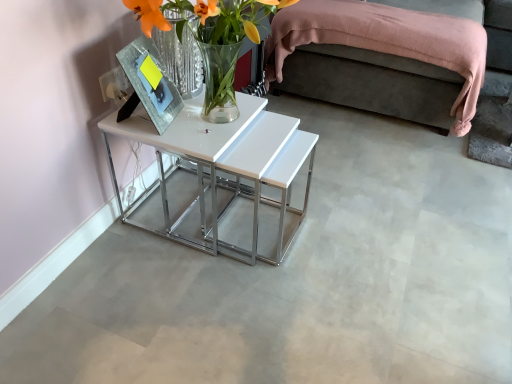
Question: Is translucent glass vase at center wider than white glossy table at center?

Choices:
 (A) yes
 (B) no

Answer: (B)

Question: Is translucent glass vase at center thinner than white glossy table at center?

Choices:
 (A) no
 (B) yes

Answer: (B)

Question: Is translucent glass vase at center touching white glossy table at center?

Choices:
 (A) yes
 (B) no

Answer: (B)

Question: From the image's perspective, is translucent glass vase at center located above white glossy table at center?

Choices:
 (A) no
 (B) yes

Answer: (B)

Question: Is translucent glass vase at center shorter than white glossy table at center?

Choices:
 (A) no
 (B) yes

Answer: (B)

Question: From a real-world perspective, is translucent glass vase at center below white glossy table at center?

Choices:
 (A) no
 (B) yes

Answer: (A)

Question: From the image's perspective, is white glossy table at center located beneath translucent glass vase at center?

Choices:
 (A) no
 (B) yes

Answer: (B)

Question: Is white glossy table at center beside translucent glass vase at center?

Choices:
 (A) yes
 (B) no

Answer: (B)

Question: Is translucent glass vase at center located within white glossy table at center?

Choices:
 (A) no
 (B) yes

Answer: (A)

Question: Considering the relative positions of white glossy table at center and translucent glass vase at center in the image provided, is white glossy table at center to the left of translucent glass vase at center from the viewer's perspective?

Choices:
 (A) no
 (B) yes

Answer: (B)

Question: Is white glossy table at center positioned in front of translucent glass vase at center?

Choices:
 (A) no
 (B) yes

Answer: (A)

Question: Is there a large distance between white glossy table at center and translucent glass vase at center?

Choices:
 (A) no
 (B) yes

Answer: (A)

Question: Can you confirm if white glossy table at center is smaller than pink fabric bed at upper right?

Choices:
 (A) yes
 (B) no

Answer: (A)